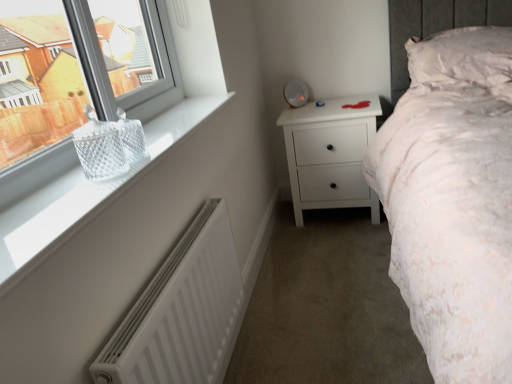
Where is `vacant space situated above white matte radiator at lower left (from a real-world perspective)`? The image size is (512, 384). vacant space situated above white matte radiator at lower left (from a real-world perspective) is located at coordinates (159, 283).